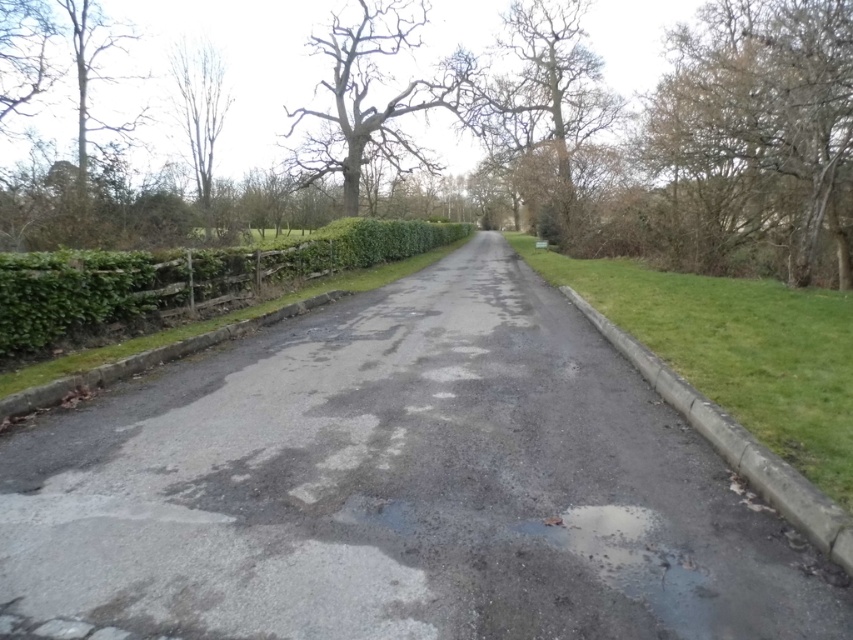
Who is positioned more to the right, green grass at right or green leafy hedge at left?

From the viewer's perspective, green grass at right appears more on the right side.

Who is higher up, green grass at right or green leafy hedge at left?

green leafy hedge at left is above.

Does point (809, 337) come behind point (90, 310)?

No, it is not.

You are a GUI agent. You are given a task and a screenshot of the screen. Output one action in this format:
    pyautogui.click(x=<x>, y=<y>)
    Task: Click on the green grass at right
    This screenshot has width=853, height=640.
    Given the screenshot: What is the action you would take?
    pyautogui.click(x=737, y=349)

Is porous asphalt driveway at center wider than smooth brown tree trunk at center?

No.

Between porous asphalt driveway at center and smooth brown tree trunk at center, which one appears on the right side from the viewer's perspective?

From the viewer's perspective, smooth brown tree trunk at center appears more on the right side.

Is point (67, 419) in front of point (769, 109)?

Yes, point (67, 419) is in front of point (769, 109).

Identify the location of porous asphalt driveway at center. (398, 490).

Who is higher up, smooth brown tree trunk at center or green leafy hedge at left?

Positioned higher is smooth brown tree trunk at center.

Can you confirm if smooth brown tree trunk at center is smaller than green leafy hedge at left?

Actually, smooth brown tree trunk at center might be larger than green leafy hedge at left.

Find the location of a particular element. The image size is (853, 640). smooth brown tree trunk at center is located at coordinates (587, 131).